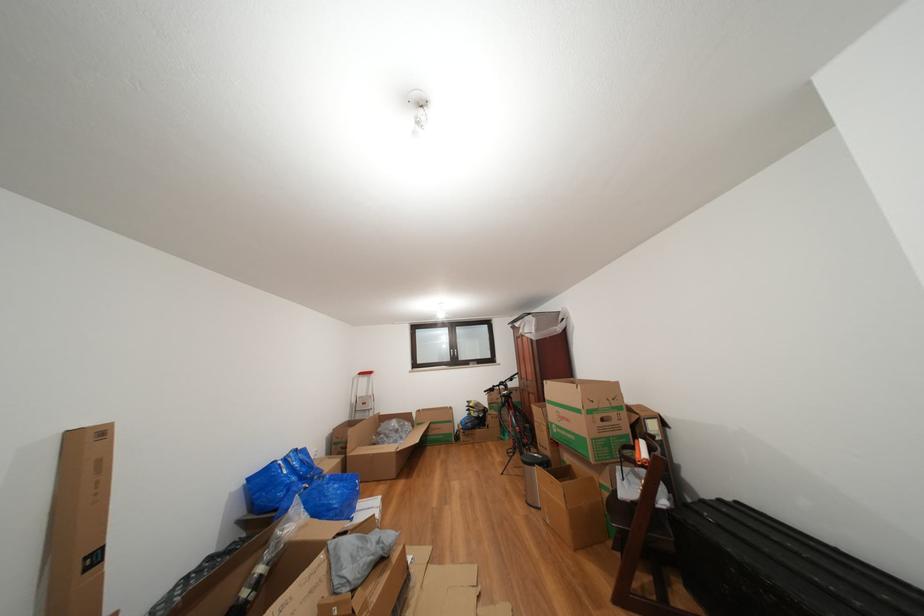
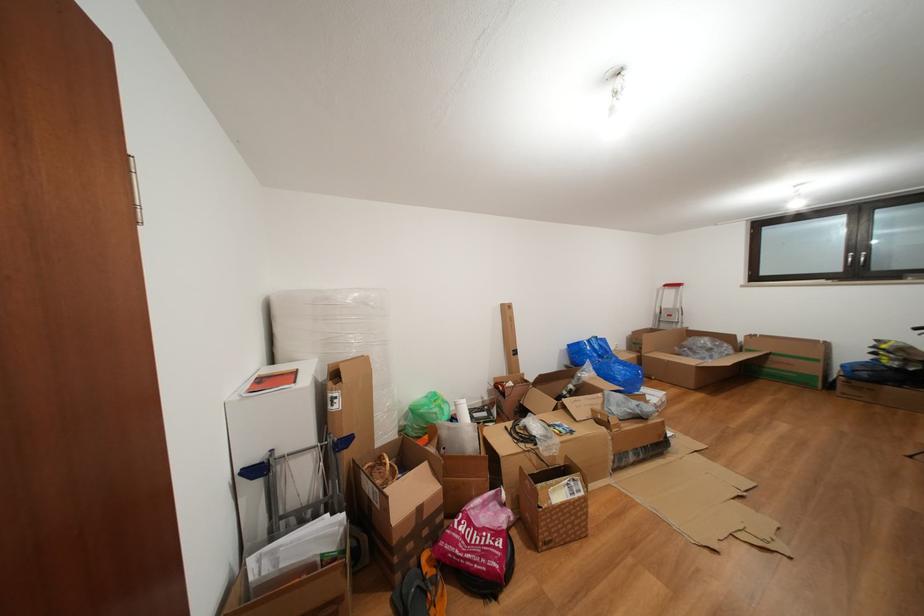
In the second image, find the point that corresponds to (x=481, y=432) in the first image.

(886, 387)